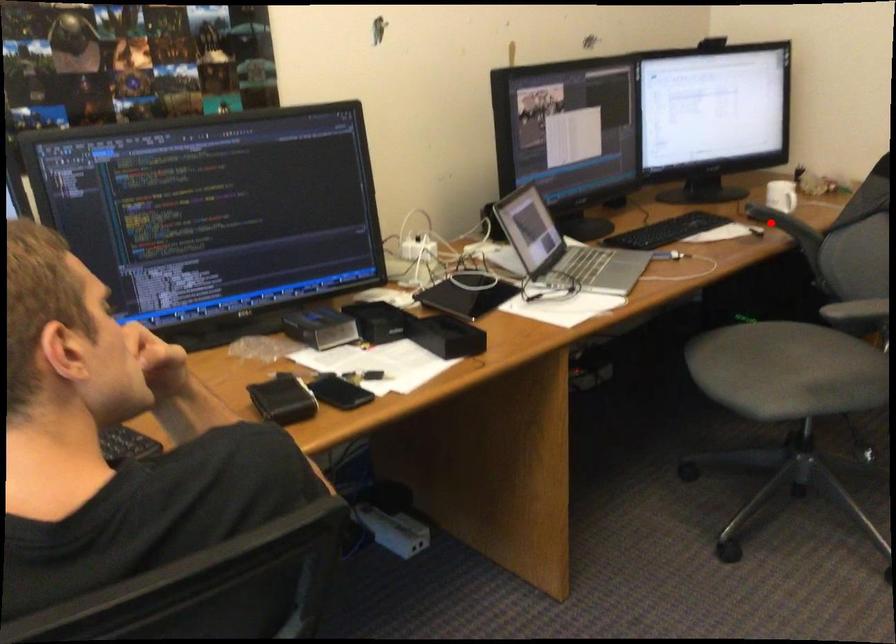
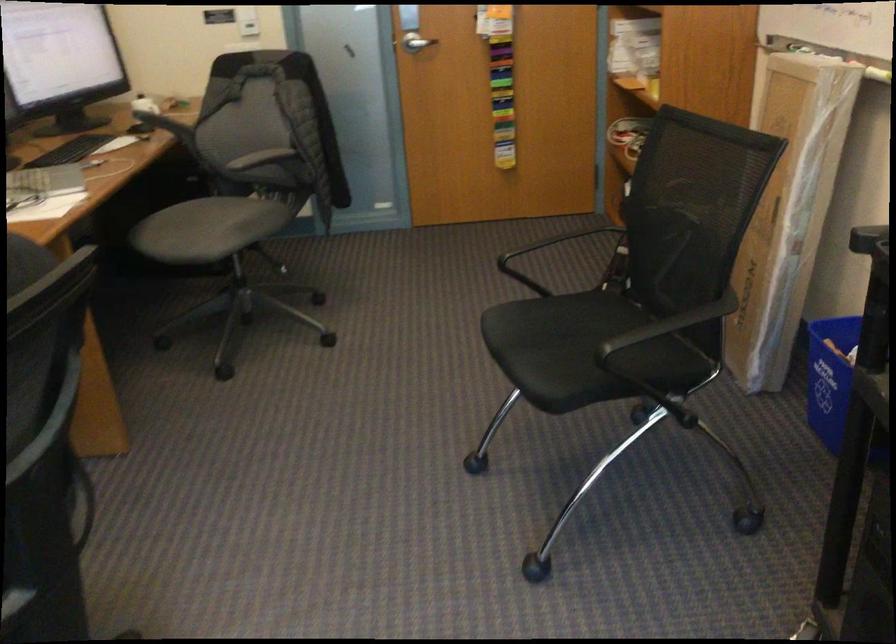
In the second image, find the point that corresponds to the highlighted location in the first image.

(158, 120)